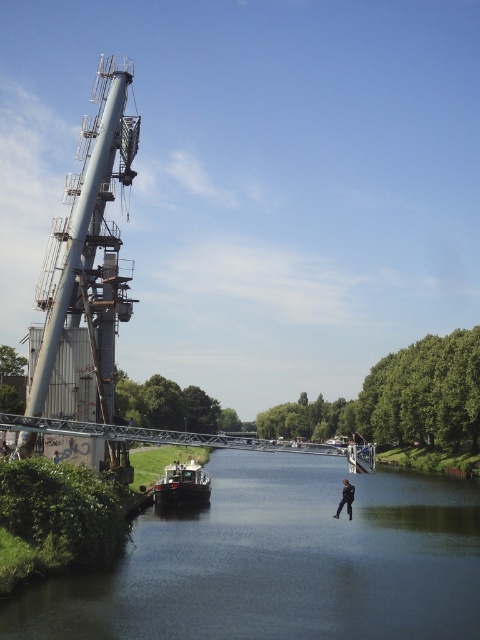
Between dark blue water at center and gray metallic tower at left, which one has less height?

With less height is dark blue water at center.

Between dark blue water at center and gray metallic tower at left, which one is positioned higher?

gray metallic tower at left

Where is `dark blue water at center`? This screenshot has height=640, width=480. dark blue water at center is located at coordinates [280, 563].

Between dark brown wooden boat at center and dark blue jeans at lower center, which one is positioned lower?

dark brown wooden boat at center is below.

You are a GUI agent. You are given a task and a screenshot of the screen. Output one action in this format:
    pyautogui.click(x=<x>, y=<y>)
    Task: Click on the dark brown wooden boat at center
    This screenshot has width=480, height=640.
    Given the screenshot: What is the action you would take?
    click(x=182, y=484)

Consider the image. Is dark blue water at center to the right of dark brown wooden boat at center from the viewer's perspective?

Indeed, dark blue water at center is positioned on the right side of dark brown wooden boat at center.

Does point (439, 520) come farther from viewer compared to point (165, 502)?

No, (439, 520) is closer to viewer.

Locate an element on the screen. dark blue water at center is located at coordinates (280, 563).